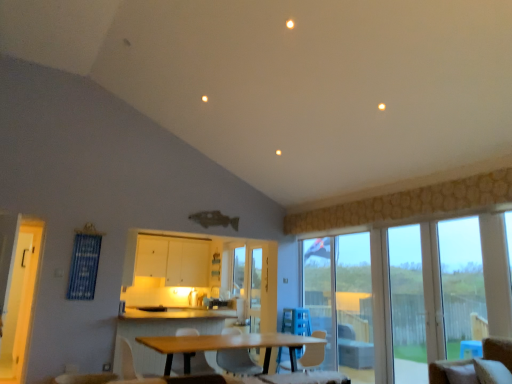
Question: From a real-world perspective, is white matte cabinet at center physically below clear glass door at right, which appears as the 2th window when viewed from the right?

Choices:
 (A) yes
 (B) no

Answer: (B)

Question: Is white matte cabinet at center closer to camera compared to clear glass door at right, acting as the first window starting from the left?

Choices:
 (A) yes
 (B) no

Answer: (B)

Question: Is white matte cabinet at center not inside clear glass door at right, acting as the first window starting from the left?

Choices:
 (A) no
 (B) yes

Answer: (B)

Question: Is white matte cabinet at center shorter than clear glass door at right, acting as the first window starting from the left?

Choices:
 (A) no
 (B) yes

Answer: (B)

Question: Is white matte cabinet at center smaller than clear glass door at right, acting as the first window starting from the left?

Choices:
 (A) yes
 (B) no

Answer: (B)

Question: Considering the positions of wooden table at center and beige fabric chair at lower right, acting as the first chair starting from the front, in the image, is wooden table at center taller or shorter than beige fabric chair at lower right, acting as the first chair starting from the front,?

Choices:
 (A) tall
 (B) short

Answer: (A)

Question: From the image's perspective, relative to beige fabric chair at lower right, acting as the 1th chair starting from the right, is wooden table at center above or below?

Choices:
 (A) below
 (B) above

Answer: (A)

Question: Looking at the image, does wooden table at center seem bigger or smaller compared to beige fabric chair at lower right, the third chair in the left-to-right sequence?

Choices:
 (A) small
 (B) big

Answer: (B)

Question: Does point (266, 352) appear closer or farther from the camera than point (488, 380)?

Choices:
 (A) closer
 (B) farther

Answer: (B)

Question: In the image, is white plastic chair at center, which is the third chair in front-to-back order, positioned in front of or behind yellow wood screen door at left, the second screen door from the right?

Choices:
 (A) front
 (B) behind

Answer: (B)

Question: Considering the positions of white plastic chair at center, arranged as the 2th chair when viewed from the right, and yellow wood screen door at left, the second screen door from the right, in the image, is white plastic chair at center, arranged as the 2th chair when viewed from the right, taller or shorter than yellow wood screen door at left, the second screen door from the right,?

Choices:
 (A) short
 (B) tall

Answer: (A)

Question: Is point (303, 367) positioned closer to the camera than point (28, 337)?

Choices:
 (A) closer
 (B) farther

Answer: (A)

Question: From the image's perspective, is white plastic chair at center, which is the third chair in front-to-back order, above or below yellow wood screen door at left, placed as the 2th screen door when sorted from back to front?

Choices:
 (A) above
 (B) below

Answer: (B)

Question: In terms of height, does matte gray chair at center, the second chair in the front-to-back sequence, look taller or shorter compared to white plastic armchair at lower center, positioned as the second armchair in back-to-front order?

Choices:
 (A) tall
 (B) short

Answer: (A)

Question: Is point (236, 349) positioned closer to the camera than point (125, 369)?

Choices:
 (A) closer
 (B) farther

Answer: (A)